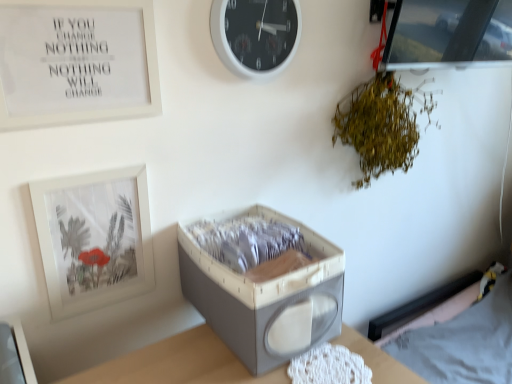
At what (x,y) coordinates should I click in order to perform the action: click on white matte picture frame at upper left, which is the second picture frame from left to right. Please return your answer as a coordinate pair (x, y). Looking at the image, I should click on (76, 62).

What is the approximate width of white matte picture frame at upper left, which is the second picture frame from bottom to top?

It is 0.82 inches.

What do you see at coordinates (449, 34) in the screenshot? I see `transparent glass picture frame at upper right, the third picture frame positioned from the bottom` at bounding box center [449, 34].

Locate an element on the screen. gray fabric storage box at center is located at coordinates 266,298.

Identify the location of white matte picture frame at upper left, the 2th picture frame when ordered from right to left. (76, 62).

How different are the orientations of white plastic wall clock at upper center and white matte picture frame at upper left, which is the second picture frame from bottom to top, in degrees?

They differ by 0.91 degrees in their facing directions.

In terms of width, does white plastic wall clock at upper center look wider or thinner when compared to white matte picture frame at upper left, which is counted as the second picture frame, starting from the top?

Considering their sizes, white plastic wall clock at upper center looks broader than white matte picture frame at upper left, which is counted as the second picture frame, starting from the top.

Considering the relative sizes of white plastic wall clock at upper center and white matte picture frame at upper left, which is the second picture frame from left to right, in the image provided, is white plastic wall clock at upper center smaller than white matte picture frame at upper left, which is the second picture frame from left to right,?

No, white plastic wall clock at upper center is not smaller than white matte picture frame at upper left, which is the second picture frame from left to right.

Which is more to the left, white plastic wall clock at upper center or white matte picture frame at upper left, which is the second picture frame from bottom to top?

white matte picture frame at upper left, which is the second picture frame from bottom to top, is more to the left.

Is gray fabric storage box at center at the back of white fabric hospital bed at lower right?

white fabric hospital bed at lower right does not have its back to gray fabric storage box at center.

Is white fabric hospital bed at lower right taller than gray fabric storage box at center?

Yes, white fabric hospital bed at lower right is taller than gray fabric storage box at center.

Which object is positioned more to the right, white fabric hospital bed at lower right or gray fabric storage box at center?

white fabric hospital bed at lower right.

Relative to gray fabric storage box at center, is white fabric hospital bed at lower right in front or behind?

white fabric hospital bed at lower right is behind gray fabric storage box at center.

From the image's perspective, which picture frame is the 2nd one above the white fabric hospital bed at lower right? Please provide its 2D coordinates.

[(76, 62)]

Is white matte picture frame at upper left, which is the second picture frame from left to right, completely or partially inside white fabric hospital bed at lower right?

Definitely not — white matte picture frame at upper left, which is the second picture frame from left to right, is not inside white fabric hospital bed at lower right.

Considering the sizes of objects white fabric hospital bed at lower right and white matte picture frame at upper left, which is the second picture frame from bottom to top, in the image provided, who is taller, white fabric hospital bed at lower right or white matte picture frame at upper left, which is the second picture frame from bottom to top,?

Standing taller between the two is white fabric hospital bed at lower right.

Is white fabric hospital bed at lower right turned away from white matte picture frame at upper left, which is counted as the second picture frame, starting from the top?

No, white fabric hospital bed at lower right is not facing away from white matte picture frame at upper left, which is counted as the second picture frame, starting from the top.

Which is more to the left, white matte picture frame at upper left, marked as the 1th picture frame in a bottom-to-top arrangement, or white matte picture frame at upper left, which is the second picture frame from bottom to top?

From the viewer's perspective, white matte picture frame at upper left, marked as the 1th picture frame in a bottom-to-top arrangement, appears more on the left side.

From the image's perspective, would you say white matte picture frame at upper left, positioned as the 3th picture frame in right-to-left order, is positioned over white matte picture frame at upper left, which is counted as the second picture frame, starting from the top?

Actually, white matte picture frame at upper left, positioned as the 3th picture frame in right-to-left order, appears below white matte picture frame at upper left, which is counted as the second picture frame, starting from the top, in the image.

Is white matte picture frame at upper left, which is the 3th picture frame from top to bottom, smaller than white matte picture frame at upper left, which is counted as the second picture frame, starting from the top?

Yes.

Can you confirm if white plastic wall clock at upper center is bigger than white matte picture frame at upper left, marked as the 1th picture frame in a bottom-to-top arrangement?

Yes.

Considering the relative sizes of white plastic wall clock at upper center and white matte picture frame at upper left, marked as the 1th picture frame in a bottom-to-top arrangement, in the image provided, is white plastic wall clock at upper center taller than white matte picture frame at upper left, marked as the 1th picture frame in a bottom-to-top arrangement,?

No.

Is point (300, 24) positioned after point (100, 265)?

Yes, point (300, 24) is behind point (100, 265).

Is white plastic wall clock at upper center to the left or to the right of white matte picture frame at upper left, marked as the 1th picture frame in a bottom-to-top arrangement, in the image?

Clearly, white plastic wall clock at upper center is on the right of white matte picture frame at upper left, marked as the 1th picture frame in a bottom-to-top arrangement, in the image.

Considering the positions of objects green leafy plant at upper right and transparent glass picture frame at upper right, arranged as the 3th picture frame when viewed from the left, in the image provided, who is more to the right, green leafy plant at upper right or transparent glass picture frame at upper right, arranged as the 3th picture frame when viewed from the left,?

From the viewer's perspective, transparent glass picture frame at upper right, arranged as the 3th picture frame when viewed from the left, appears more on the right side.

How far apart are green leafy plant at upper right and transparent glass picture frame at upper right, the first picture frame from the right?

The distance of green leafy plant at upper right from transparent glass picture frame at upper right, the first picture frame from the right, is 8.57 inches.

From the image's perspective, is green leafy plant at upper right above or below transparent glass picture frame at upper right, the 1th picture frame positioned from the top?

green leafy plant at upper right is situated lower than transparent glass picture frame at upper right, the 1th picture frame positioned from the top, in the image.

In terms of size, does green leafy plant at upper right appear bigger or smaller than transparent glass picture frame at upper right, the third picture frame positioned from the bottom?

In the image, green leafy plant at upper right appears to be larger than transparent glass picture frame at upper right, the third picture frame positioned from the bottom.

Is gray fabric storage box at center beside green leafy plant at upper right?

gray fabric storage box at center and green leafy plant at upper right are clearly separated.

Considering the relative positions of gray fabric storage box at center and green leafy plant at upper right in the image provided, is gray fabric storage box at center to the right of green leafy plant at upper right from the viewer's perspective?

No, gray fabric storage box at center is not to the right of green leafy plant at upper right.

Is gray fabric storage box at center facing towards green leafy plant at upper right?

No, gray fabric storage box at center is not facing towards green leafy plant at upper right.

Find the location of a particular element. The height and width of the screenshot is (384, 512). picture frame that is the 1st one when counting downward from the white plastic wall clock at upper center (from the image's perspective) is located at coordinates (76, 62).

Locate an element on the screen. The width and height of the screenshot is (512, 384). hospital bed below the gray fabric storage box at center (from a real-world perspective) is located at coordinates (461, 335).

Looking at the image, which one is located closer to white fabric hospital bed at lower right, transparent glass picture frame at upper right, the 1th picture frame positioned from the top, or white matte picture frame at upper left, the 2th picture frame when ordered from right to left?

Among the two, transparent glass picture frame at upper right, the 1th picture frame positioned from the top, is located nearer to white fabric hospital bed at lower right.

Based on their spatial positions, is transparent glass picture frame at upper right, the 1th picture frame positioned from the top, or gray fabric storage box at center further from white matte picture frame at upper left, which appears as the 1th picture frame when viewed from the left?

transparent glass picture frame at upper right, the 1th picture frame positioned from the top.

Which object lies nearer to the anchor point transparent glass picture frame at upper right, the 1th picture frame positioned from the top, gray fabric storage box at center or white plastic wall clock at upper center?

Among the two, white plastic wall clock at upper center is located nearer to transparent glass picture frame at upper right, the 1th picture frame positioned from the top.

Which object lies nearer to the anchor point white matte picture frame at upper left, which is the 3th picture frame from top to bottom, green leafy plant at upper right or white matte picture frame at upper left, the 2th picture frame when ordered from right to left?

white matte picture frame at upper left, the 2th picture frame when ordered from right to left, is closer to white matte picture frame at upper left, which is the 3th picture frame from top to bottom.

From the picture: When comparing their distances from transparent glass picture frame at upper right, the first picture frame from the right, does white plastic wall clock at upper center or white matte picture frame at upper left, which appears as the 1th picture frame when viewed from the left, seem closer?

Among the two, white plastic wall clock at upper center is located nearer to transparent glass picture frame at upper right, the first picture frame from the right.

Based on their spatial positions, is transparent glass picture frame at upper right, the third picture frame positioned from the bottom, or white plastic wall clock at upper center closer to green leafy plant at upper right?

transparent glass picture frame at upper right, the third picture frame positioned from the bottom.

Based on their spatial positions, is white fabric hospital bed at lower right or green leafy plant at upper right closer to white matte picture frame at upper left, the 2th picture frame when ordered from right to left?

Based on the image, green leafy plant at upper right appears to be nearer to white matte picture frame at upper left, the 2th picture frame when ordered from right to left.

Looking at the image, which one is located further to white plastic wall clock at upper center, white matte picture frame at upper left, which is the 3th picture frame from top to bottom, or white matte picture frame at upper left, which is counted as the second picture frame, starting from the top?

Among the two, white matte picture frame at upper left, which is the 3th picture frame from top to bottom, is located further to white plastic wall clock at upper center.

This screenshot has height=384, width=512. In order to click on picture frame between white plastic wall clock at upper center and white matte picture frame at upper left, positioned as the 3th picture frame in right-to-left order, in the vertical direction in this screenshot , I will do (x=76, y=62).

Locate an element on the screen. The width and height of the screenshot is (512, 384). picture frame between white matte picture frame at upper left, marked as the 1th picture frame in a bottom-to-top arrangement, and transparent glass picture frame at upper right, the 1th picture frame positioned from the top is located at coordinates (76, 62).

Locate an element on the screen. The image size is (512, 384). wall clock that lies between transparent glass picture frame at upper right, the third picture frame positioned from the bottom, and white fabric hospital bed at lower right from top to bottom is located at coordinates point(255,34).

Locate an element on the screen. storage box between white matte picture frame at upper left, which appears as the 1th picture frame when viewed from the left, and transparent glass picture frame at upper right, the first picture frame from the right, from left to right is located at coordinates (266, 298).